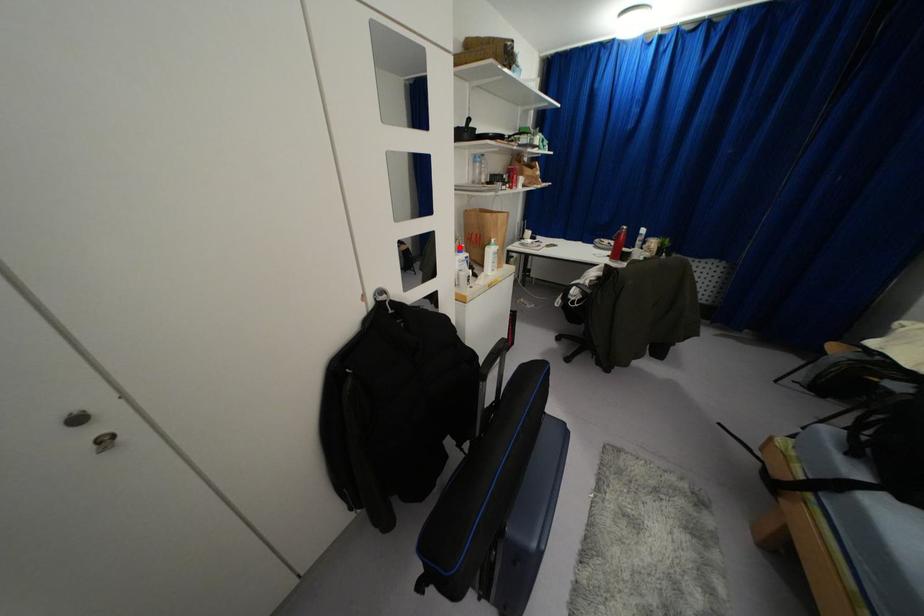
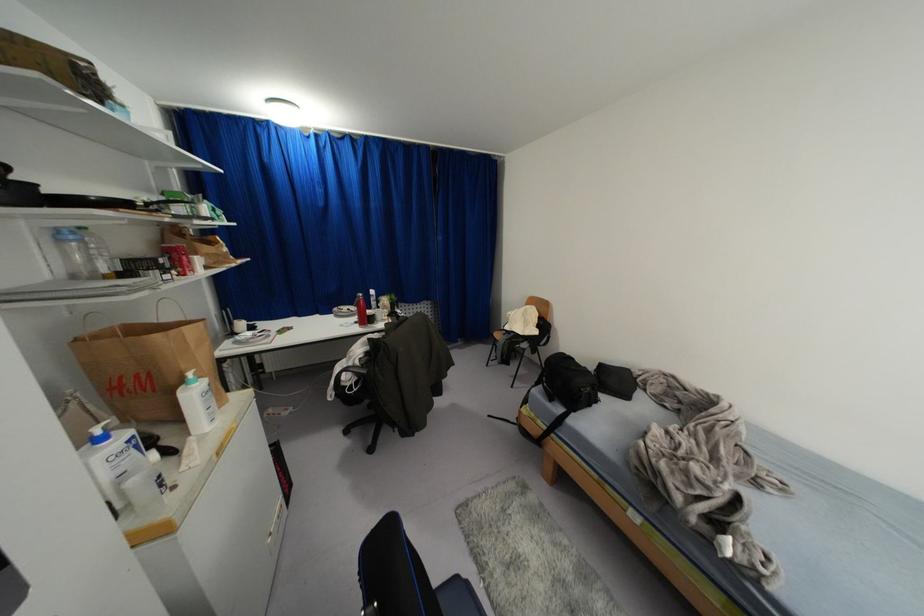
Question: I am providing you with two images of the same scene from different viewpoints. Image1 has a red point marked. In image2, the corresponding 3D location appears at what relative position? Reply with the corresponding letter.

Choices:
 (A) Closer
 (B) Farther

Answer: (B)